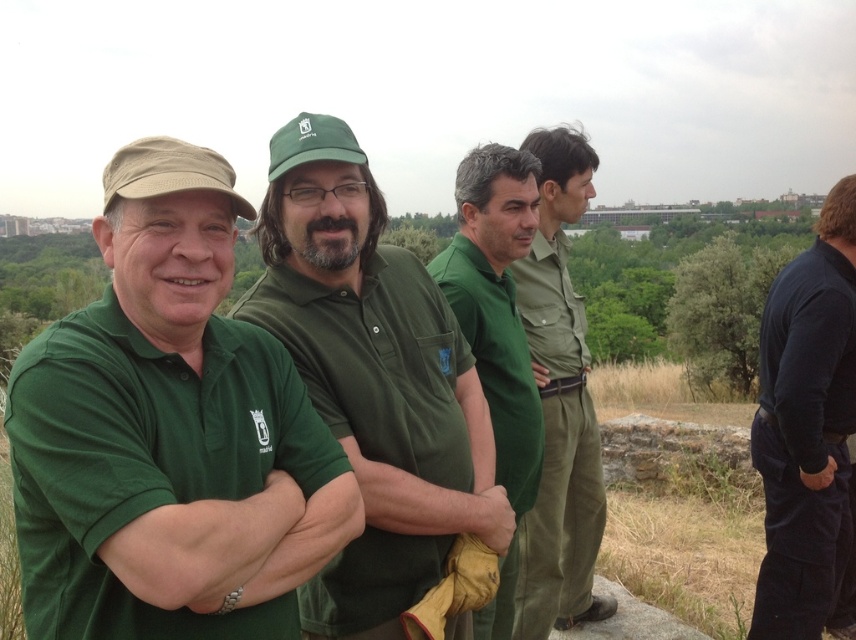
Between dark blue fabric pants at right and dark blue fabric at right, which one has less height?

With less height is dark blue fabric at right.

Where is `dark blue fabric pants at right`? The width and height of the screenshot is (856, 640). dark blue fabric pants at right is located at coordinates point(806,426).

The height and width of the screenshot is (640, 856). Identify the location of dark blue fabric pants at right. (806, 426).

Is the position of dark blue fabric pants at right more distant than that of matte green uniform at center?

Yes, dark blue fabric pants at right is further from the viewer.

Does dark blue fabric pants at right appear on the right side of matte green uniform at center?

Indeed, dark blue fabric pants at right is positioned on the right side of matte green uniform at center.

At what (x,y) coordinates should I click in order to perform the action: click on dark blue fabric pants at right. Please return your answer as a coordinate pair (x, y). Looking at the image, I should click on (806, 426).

Locate an element on the screen. The image size is (856, 640). dark blue fabric pants at right is located at coordinates 806,426.

Can you confirm if green matte shirt at left is shorter than green cotton shirt at center?

Indeed, green matte shirt at left has a lesser height compared to green cotton shirt at center.

Which is in front, point (164, 568) or point (524, 449)?

Point (164, 568) is more forward.

Where is `green matte shirt at left`? This screenshot has width=856, height=640. green matte shirt at left is located at coordinates (168, 518).